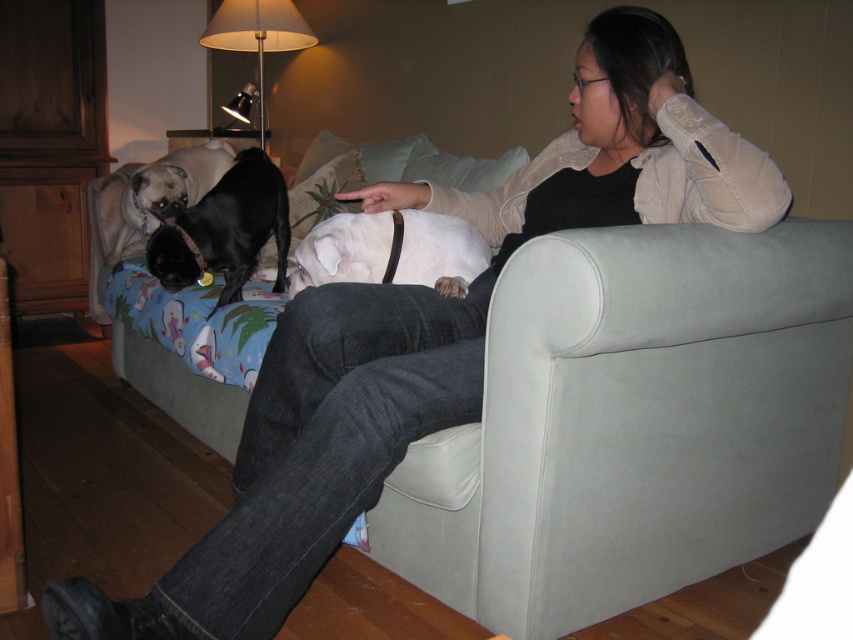
You are a dog trainer assessing the space between two dogs in the image. The white matte dog at center and the black smooth dog at center are both on the sofa. If you need to place a 20 cm wide toy between them, will there be enough space?

The white matte dog at center is narrower than the black smooth dog at center. However, the exact distance between them isn

You are a dog breeder assessing the dogs in the image. Which dog has a greater height between the black smooth dog at center and the matte black dog at upper left?

The black smooth dog at center has a greater height compared to the matte black dog at upper left.

You are a photographer trying to capture a clear photo of the black smooth dog at center. However, the matte black dog at upper left is blocking your view. Can you adjust your position to avoid the obstruction?

The black smooth dog at center is positioned under the matte black dog at upper left, so moving your camera position lower or shifting to the side might allow you to capture the black smooth dog at center without obstruction from the matte black dog at upper left.